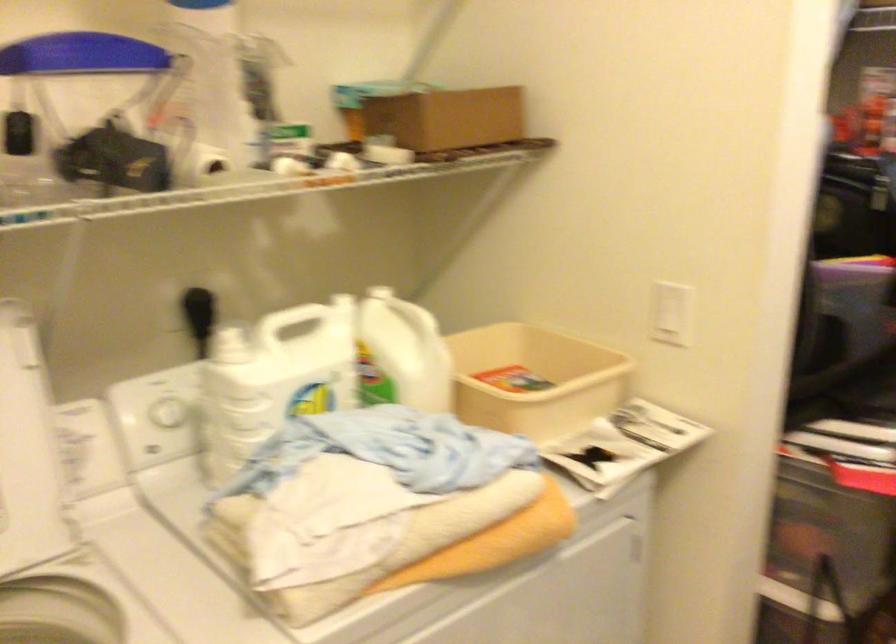
Describe the element at coordinates (168, 412) in the screenshot. The width and height of the screenshot is (896, 644). I see `a washing machine dial` at that location.